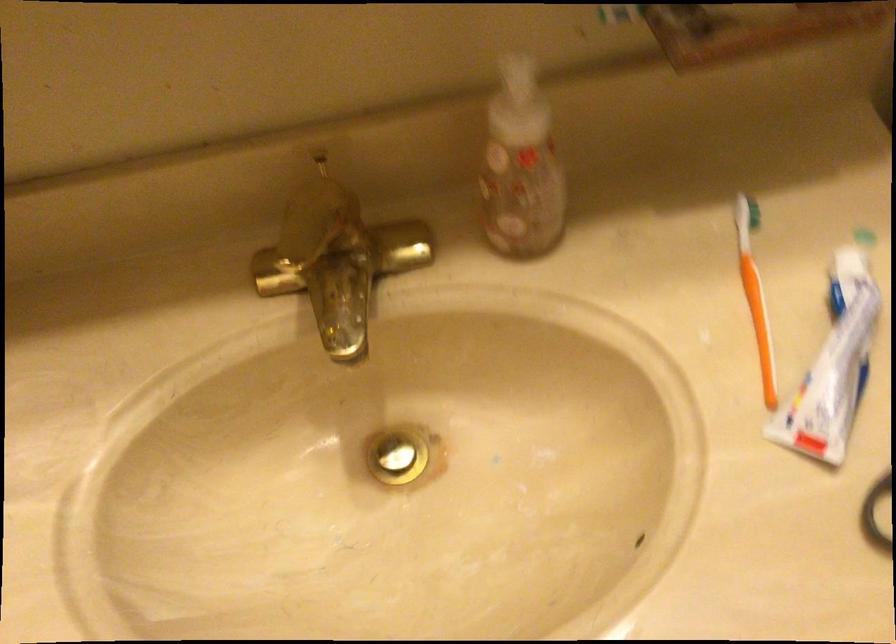
Describe the element at coordinates (337, 259) in the screenshot. I see `the faucet handle` at that location.